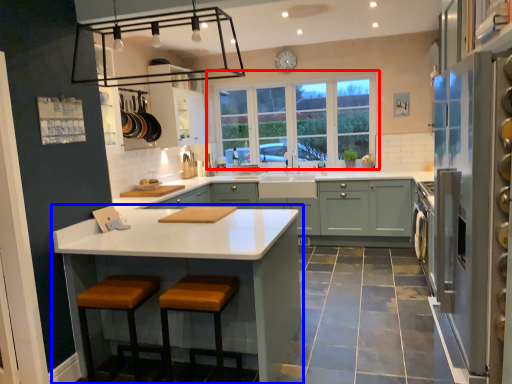
Question: Which of the following is the closest to the observer, window (highlighted by a red box) or countertop (highlighted by a blue box)?

Choices:
 (A) window
 (B) countertop

Answer: (B)